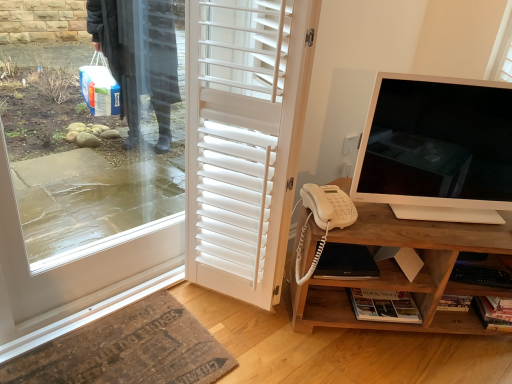
This screenshot has height=384, width=512. I want to click on free location above rug at lower left (from a real-world perspective), so click(x=126, y=351).